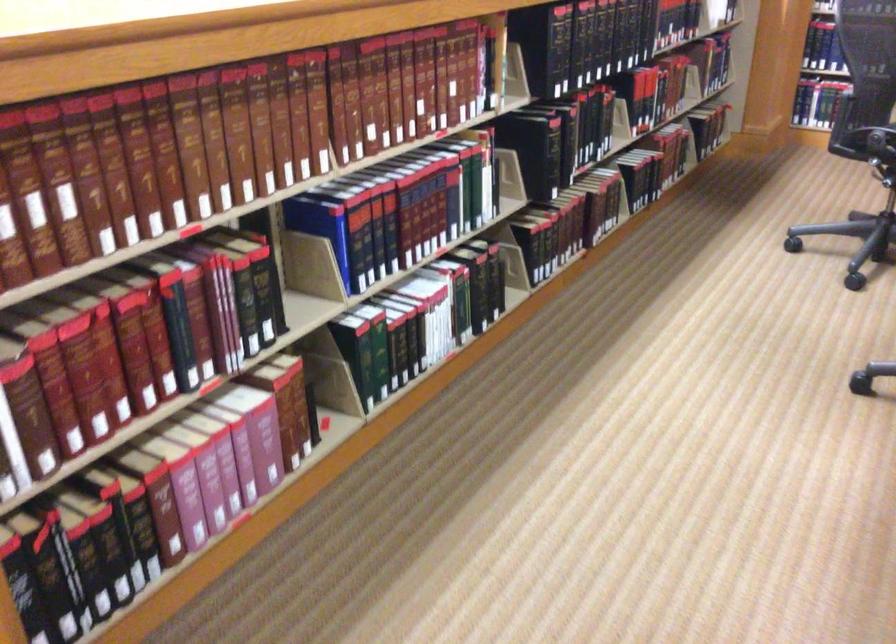
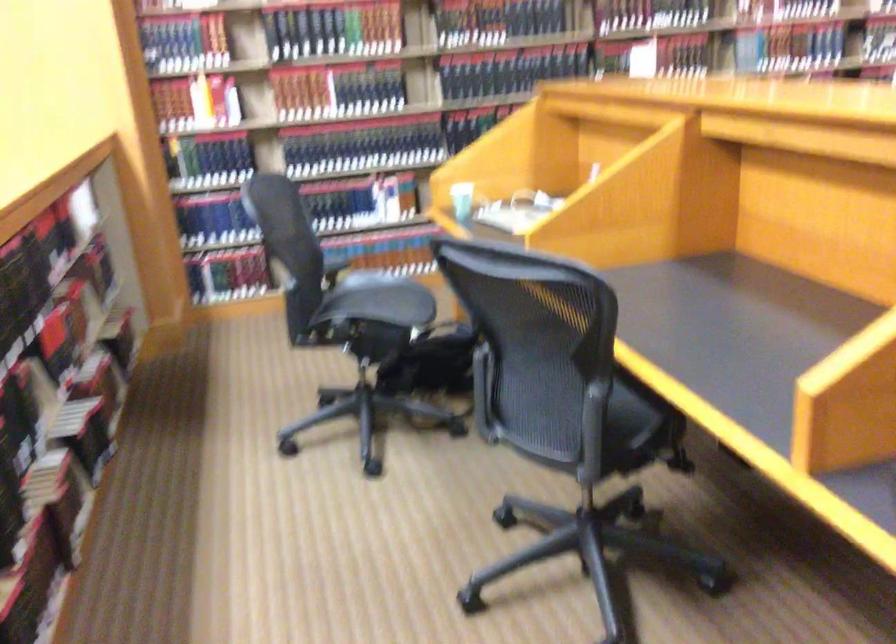
Question: Based on the continuous images, in which direction is the camera rotating? Reply with the corresponding letter.

Choices:
 (A) Left
 (B) Right
 (C) Up
 (D) Down

Answer: (B)